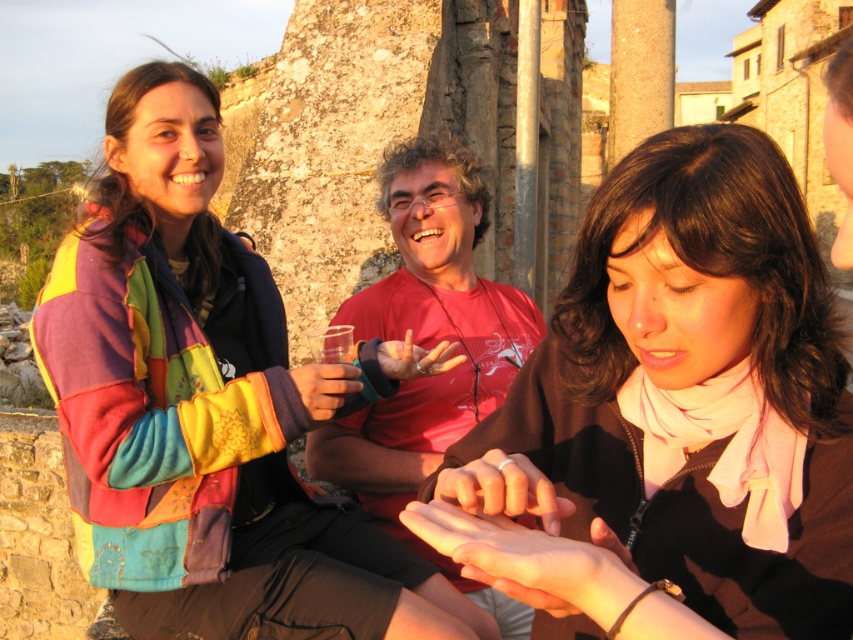
Based on the photo, you are standing at the point labeled point (741, 204) and want to walk to the point labeled point (184, 518). Which direction should you move relative to your current position?

To reach point (184, 518) from point (741, 204), you should move forward because point (184, 518) is behind point (741, 204).

You are a photographer trying to capture a group photo of the multicolored fleece jacket at upper left and the brown matte scarf at center. Which object should you focus on first if you want to ensure both are in focus, considering their sizes?

The multicolored fleece jacket at upper left is bigger than the brown matte scarf at center, so you should focus on the multicolored fleece jacket at upper left first to ensure both are in focus.